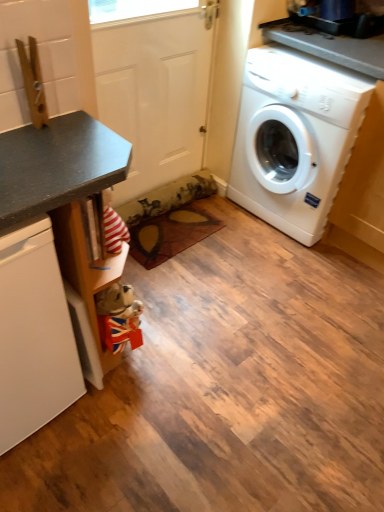
At what (x,y) coordinates should I click in order to perform the action: click on vacant area that lies to the right of white matte dishwasher at left. Please return your answer as a coordinate pair (x, y). Image resolution: width=384 pixels, height=512 pixels. Looking at the image, I should click on (137, 401).